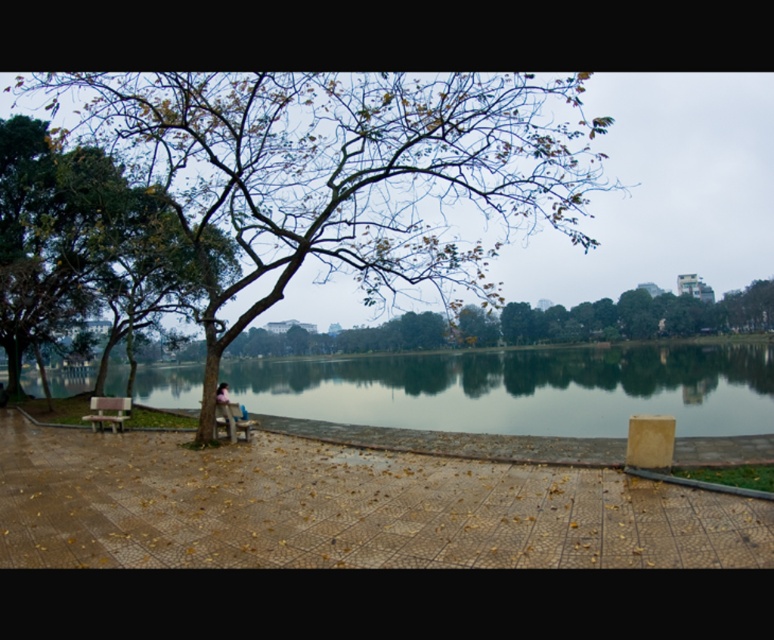
You are planning to take a photo of the green leafy tree at center and the wooden bench at lower left. Which object should you focus on first if you want to capture both in a single frame without moving the camera?

The green leafy tree at center is bigger than the wooden bench at lower left, so you should focus on the green leafy tree at center first to ensure it fits properly in the frame before adjusting for the smaller wooden bench at lower left.

You are a photographer planning to take a picture of the wooden bench at center and the green reflective water at center. Since both are in the center, how can you position your camera to capture both subjects clearly?

The green reflective water at center is positioned over the wooden bench at center, so you should angle your camera slightly downward to capture both the bench and the water reflecting above it.